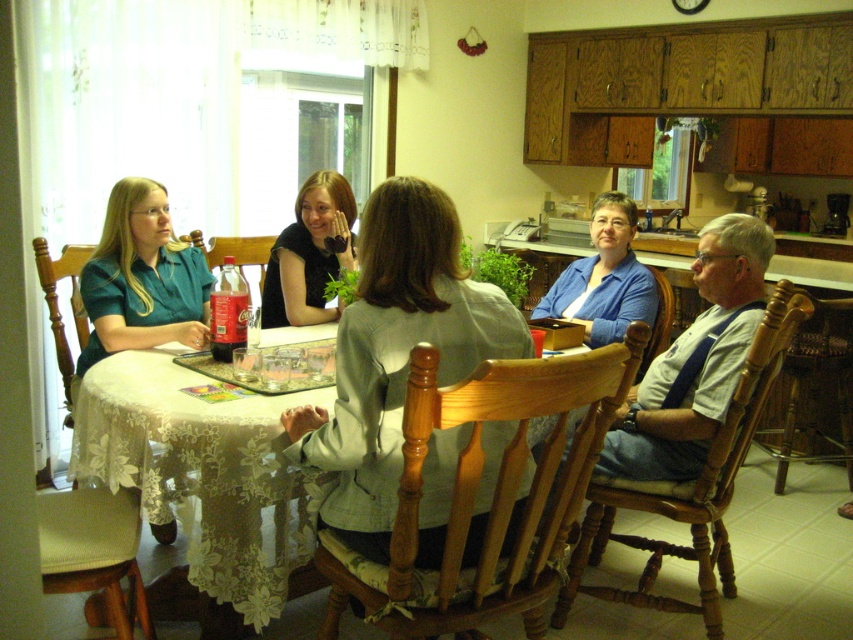
Can you confirm if white lace tablecloth at center is taller than matte teal blouse at left?

Yes, white lace tablecloth at center is taller than matte teal blouse at left.

Who is more forward, (267,525) or (173,266)?

Positioned in front is point (173,266).

This screenshot has width=853, height=640. Find the location of `white lace tablecloth at center`. white lace tablecloth at center is located at coordinates (202, 472).

Locate an element on the screen. Image resolution: width=853 pixels, height=640 pixels. white lace tablecloth at center is located at coordinates (202, 472).

Who is lower down, matte teal blouse at left or matte black shirt at center?

matte teal blouse at left is lower down.

Based on the photo, is matte teal blouse at left closer to camera compared to matte black shirt at center?

Yes, it is.

At what (x,y) coordinates should I click in order to perform the action: click on matte teal blouse at left. Please return your answer as a coordinate pair (x, y). Looking at the image, I should click on (142, 278).

Find the location of a particular element. Image resolution: width=853 pixels, height=640 pixels. matte teal blouse at left is located at coordinates (142, 278).

Is white lace tablecloth at center above matte black shirt at center?

Actually, white lace tablecloth at center is below matte black shirt at center.

Can you confirm if white lace tablecloth at center is smaller than matte black shirt at center?

Incorrect, white lace tablecloth at center is not smaller in size than matte black shirt at center.

Between point (260, 484) and point (318, 273), which one is positioned in front?

Positioned in front is point (260, 484).

Where is `white lace tablecloth at center`? white lace tablecloth at center is located at coordinates (202, 472).